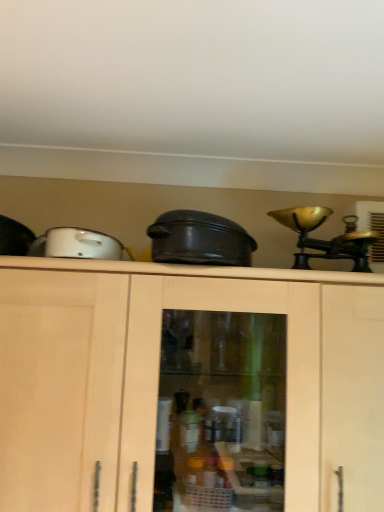
Question: Is the depth of white glossy toaster at upper left less than that of black matte crock pot at center?

Choices:
 (A) no
 (B) yes

Answer: (B)

Question: Is white glossy toaster at upper left far away from black matte crock pot at center?

Choices:
 (A) no
 (B) yes

Answer: (A)

Question: Is the depth of white glossy toaster at upper left greater than that of black matte crock pot at center?

Choices:
 (A) no
 (B) yes

Answer: (A)

Question: From the image's perspective, is white glossy toaster at upper left below black matte crock pot at center?

Choices:
 (A) yes
 (B) no

Answer: (B)

Question: Does white glossy toaster at upper left have a smaller size compared to black matte crock pot at center?

Choices:
 (A) no
 (B) yes

Answer: (B)

Question: Is white glossy toaster at upper left completely or partially outside of black matte crock pot at center?

Choices:
 (A) yes
 (B) no

Answer: (A)

Question: Does black matte crock pot at center have a greater width compared to white glossy toaster at upper left?

Choices:
 (A) yes
 (B) no

Answer: (A)

Question: Is white glossy toaster at upper left completely or partially inside black matte crock pot at center?

Choices:
 (A) yes
 (B) no

Answer: (B)

Question: Is black matte crock pot at center positioned with its back to white glossy toaster at upper left?

Choices:
 (A) no
 (B) yes

Answer: (A)

Question: Is black matte crock pot at center bigger than white glossy toaster at upper left?

Choices:
 (A) yes
 (B) no

Answer: (A)

Question: From the image's perspective, is black matte crock pot at center above white glossy toaster at upper left?

Choices:
 (A) yes
 (B) no

Answer: (B)

Question: Is black matte crock pot at center at the right side of white glossy toaster at upper left?

Choices:
 (A) yes
 (B) no

Answer: (A)

Question: Is white glossy toaster at upper left inside the boundaries of black matte crock pot at center, or outside?

Choices:
 (A) inside
 (B) outside

Answer: (B)